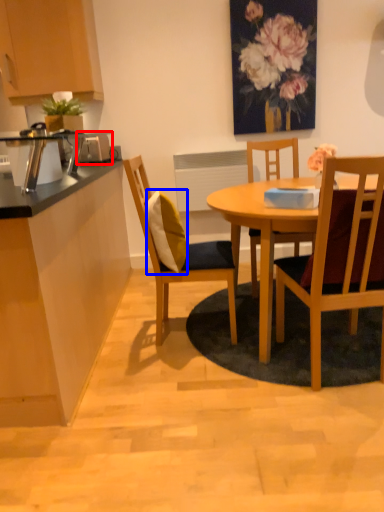
Question: Which point is further to the camera, appliance (highlighted by a red box) or pillow (highlighted by a blue box)?

Choices:
 (A) appliance
 (B) pillow

Answer: (A)